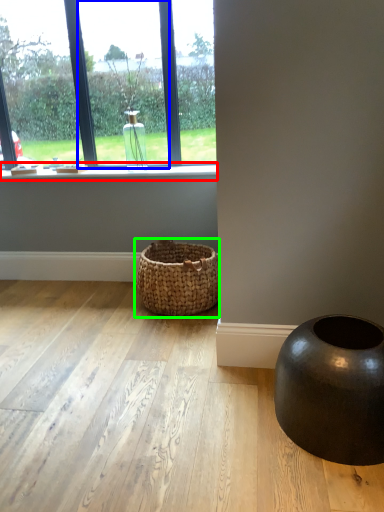
Question: Which is nearer to the window sill (highlighted by a red box)? window (highlighted by a blue box) or basket (highlighted by a green box).

Choices:
 (A) window
 (B) basket

Answer: (A)